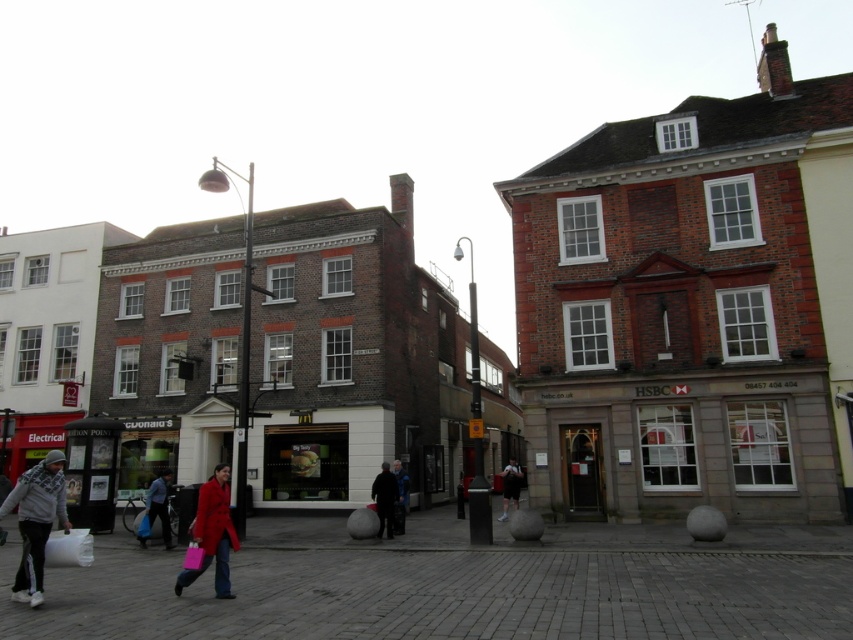
Find the location of a particular element. This screenshot has height=640, width=853. stone hsbc bank at center is located at coordinates (682, 440).

Is point (807, 474) positioned before point (457, 516)?

Yes, point (807, 474) is closer to viewer.

Is point (558, 481) closer to viewer compared to point (460, 497)?

Yes, point (558, 481) is in front of point (460, 497).

The image size is (853, 640). I want to click on stone hsbc bank at center, so click(682, 440).

Is blue denim jacket at center shorter than dark blue jeans at center?

Correct, blue denim jacket at center is not as tall as dark blue jeans at center.

Describe the element at coordinates (399, 497) in the screenshot. I see `blue denim jacket at center` at that location.

Find the location of a particular element. The width and height of the screenshot is (853, 640). blue denim jacket at center is located at coordinates (399, 497).

Is stone hsbc bank at center to the right of matte red coat at lower left from the viewer's perspective?

Yes, stone hsbc bank at center is to the right of matte red coat at lower left.

Is point (595, 445) farther from camera compared to point (201, 508)?

Yes, point (595, 445) is farther from viewer.

Is point (531, 429) less distant than point (233, 540)?

No, (531, 429) is further to viewer.

What are the coordinates of `stone hsbc bank at center` in the screenshot? It's located at (682, 440).